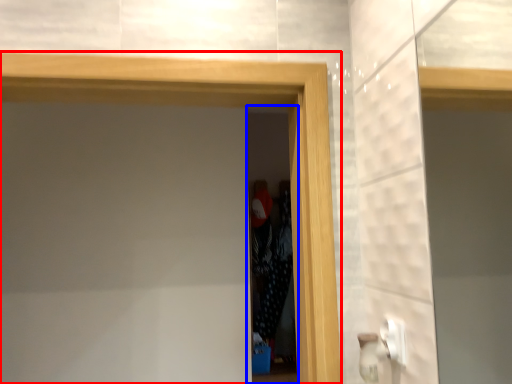
Question: Among these objects, which one is farthest to the camera, screen door (highlighted by a red box) or screen door (highlighted by a blue box)?

Choices:
 (A) screen door
 (B) screen door

Answer: (B)